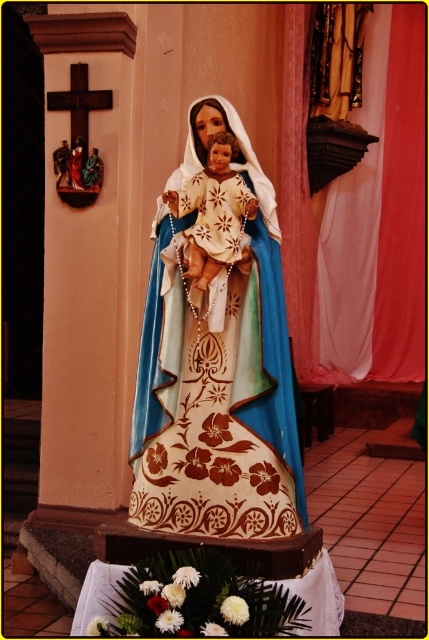
You are an art conservator examining the religious statue in the image. You notice two statues at the center. Which one is taller, the painted wood statue at center or the wooden statue at center?

The painted wood statue at center is taller than the wooden statue at center.

You are an art student observing two statues in a chapel. The first is the painted wood statue at center, and the second is the wooden statue at left. Your teacher asks you to compare their heights. Which statue is taller?

The painted wood statue at center is much taller than the wooden statue at left.